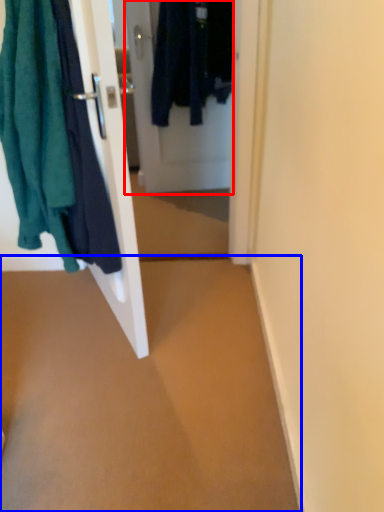
Question: Among these objects, which one is farthest to the camera, door (highlighted by a red box) or plain (highlighted by a blue box)?

Choices:
 (A) door
 (B) plain

Answer: (A)